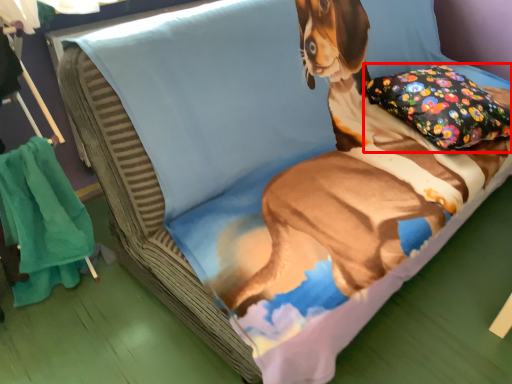
Question: From the image, what is the correct spatial relationship of pillow (annotated by the red box) in relation to blanket?

Choices:
 (A) left
 (B) right

Answer: (B)